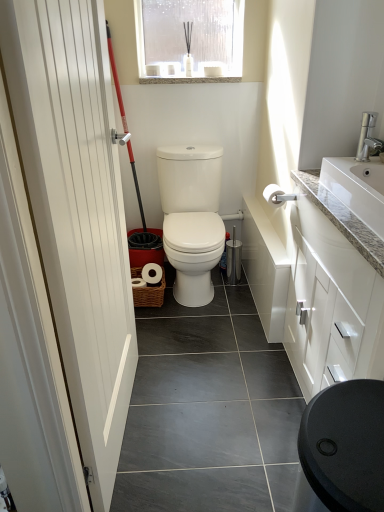
Question: Can you confirm if white granite sink at upper right is smaller than translucent plastic window at upper center?

Choices:
 (A) no
 (B) yes

Answer: (B)

Question: From a real-world perspective, is white granite sink at upper right under translucent plastic window at upper center?

Choices:
 (A) yes
 (B) no

Answer: (A)

Question: Does white granite sink at upper right lie behind translucent plastic window at upper center?

Choices:
 (A) yes
 (B) no

Answer: (B)

Question: Are white granite sink at upper right and translucent plastic window at upper center making contact?

Choices:
 (A) no
 (B) yes

Answer: (A)

Question: Considering the relative positions of white granite sink at upper right and translucent plastic window at upper center in the image provided, is white granite sink at upper right to the left of translucent plastic window at upper center from the viewer's perspective?

Choices:
 (A) yes
 (B) no

Answer: (B)

Question: Considering their positions, is silver metallic faucet at upper right located in front of or behind white smooth door at left?

Choices:
 (A) front
 (B) behind

Answer: (B)

Question: In terms of height, does silver metallic faucet at upper right look taller or shorter compared to white smooth door at left?

Choices:
 (A) tall
 (B) short

Answer: (B)

Question: Choose the correct answer: Is silver metallic faucet at upper right inside white smooth door at left or outside it?

Choices:
 (A) inside
 (B) outside

Answer: (B)

Question: Is silver metallic faucet at upper right bigger or smaller than white smooth door at left?

Choices:
 (A) small
 (B) big

Answer: (A)

Question: Looking at their shapes, would you say silver metallic faucet at upper right is wider or thinner than translucent plastic window at upper center?

Choices:
 (A) thin
 (B) wide

Answer: (A)

Question: From a real-world perspective, is silver metallic faucet at upper right positioned above or below translucent plastic window at upper center?

Choices:
 (A) below
 (B) above

Answer: (A)

Question: Is silver metallic faucet at upper right bigger or smaller than translucent plastic window at upper center?

Choices:
 (A) big
 (B) small

Answer: (B)

Question: Is point (370, 118) closer or farther from the camera than point (210, 50)?

Choices:
 (A) closer
 (B) farther

Answer: (A)

Question: From a real-world perspective, is white matte toilet paper at upper right positioned above or below white smooth door at left?

Choices:
 (A) below
 (B) above

Answer: (A)

Question: In terms of width, does white matte toilet paper at upper right look wider or thinner when compared to white smooth door at left?

Choices:
 (A) thin
 (B) wide

Answer: (B)